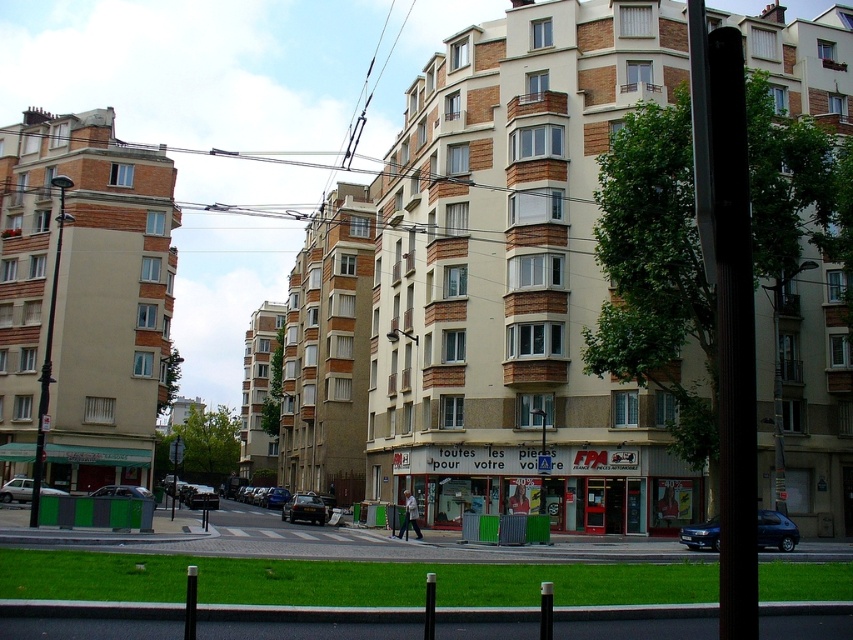
Which is more to the left, white matte car at lower left or metallic silver car at lower left?

Positioned to the left is white matte car at lower left.

Image resolution: width=853 pixels, height=640 pixels. In order to click on white matte car at lower left in this screenshot , I will do tap(16, 490).

Which is above, dark blue metallic car at lower right or metallic silver car at lower left?

dark blue metallic car at lower right

Which is behind, point (712, 538) or point (148, 493)?

The point (148, 493) is more distant.

Identify the location of dark blue metallic car at lower right. The width and height of the screenshot is (853, 640). (775, 531).

From the picture: Who is positioned more to the right, shiny black car at lower center or metallic silver car at lower left?

From the viewer's perspective, shiny black car at lower center appears more on the right side.

You are a GUI agent. You are given a task and a screenshot of the screen. Output one action in this format:
    pyautogui.click(x=<x>, y=<y>)
    Task: Click on the shiny black car at lower center
    This screenshot has height=640, width=853.
    Given the screenshot: What is the action you would take?
    pyautogui.click(x=305, y=508)

Does point (283, 513) come behind point (100, 496)?

Yes.

Find the location of a particular element. shiny black car at lower center is located at coordinates (305, 508).